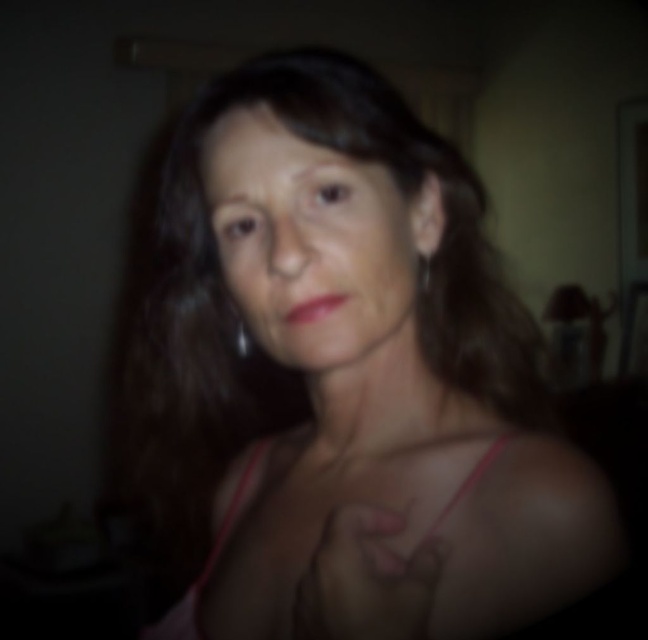
Who is shorter, pink fabric dress at center or silver metallic earring at upper right?

silver metallic earring at upper right

Is point (238, 484) closer to camera compared to point (430, 262)?

No, it is behind (430, 262).

In order to click on pink fabric dress at center in this screenshot , I will do `click(205, 563)`.

Does pink fabric at center have a greater width compared to smooth skin face at center?

Indeed, pink fabric at center has a greater width compared to smooth skin face at center.

Between pink fabric at center and smooth skin face at center, which one appears on the left side from the viewer's perspective?

pink fabric at center

The width and height of the screenshot is (648, 640). What do you see at coordinates (345, 378) in the screenshot?
I see `pink fabric at center` at bounding box center [345, 378].

Locate an element on the screen. pink fabric at center is located at coordinates (345, 378).

Between pink fabric at center and pink fabric dress at center, which one is positioned lower?

Positioned lower is pink fabric at center.

Between point (310, 388) and point (457, 493), which one is positioned behind?

Positioned behind is point (310, 388).

Where is `pink fabric at center`? The image size is (648, 640). pink fabric at center is located at coordinates [x=345, y=378].